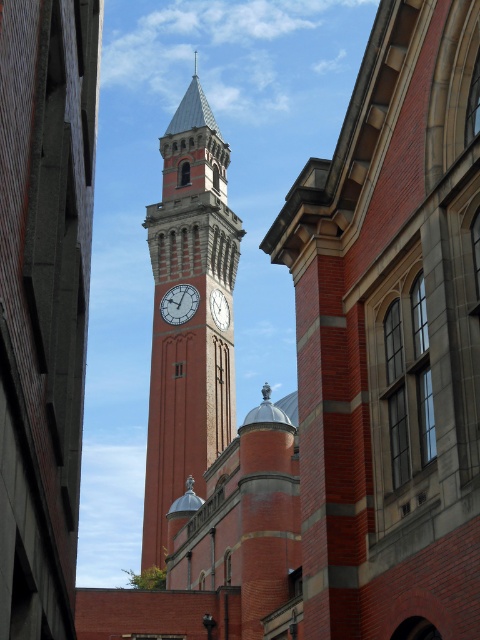
Who is higher up, red brick clock tower at center or white clock face at center?

red brick clock tower at center is above.

Which is more to the left, red brick clock tower at center or white clock face at center?

red brick clock tower at center is more to the left.

Find the location of `red brick clock tower at center`. red brick clock tower at center is located at coordinates (192, 317).

Identify the location of red brick clock tower at center. (192, 317).

Is matte brick clock at center to the right of white clock face at center from the viewer's perspective?

In fact, matte brick clock at center is to the left of white clock face at center.

Is matte brick clock at center above white clock face at center?

Correct, matte brick clock at center is located above white clock face at center.

Describe the element at coordinates (179, 304) in the screenshot. I see `matte brick clock at center` at that location.

The height and width of the screenshot is (640, 480). Find the location of `matte brick clock at center`. matte brick clock at center is located at coordinates (179, 304).

How far apart are red brick clock tower at center and matte brick clock at center?

red brick clock tower at center is 10.64 meters from matte brick clock at center.

Who is more distant from viewer, (199,477) or (196,307)?

Positioned behind is point (196,307).

Where is `red brick clock tower at center`? red brick clock tower at center is located at coordinates (192, 317).